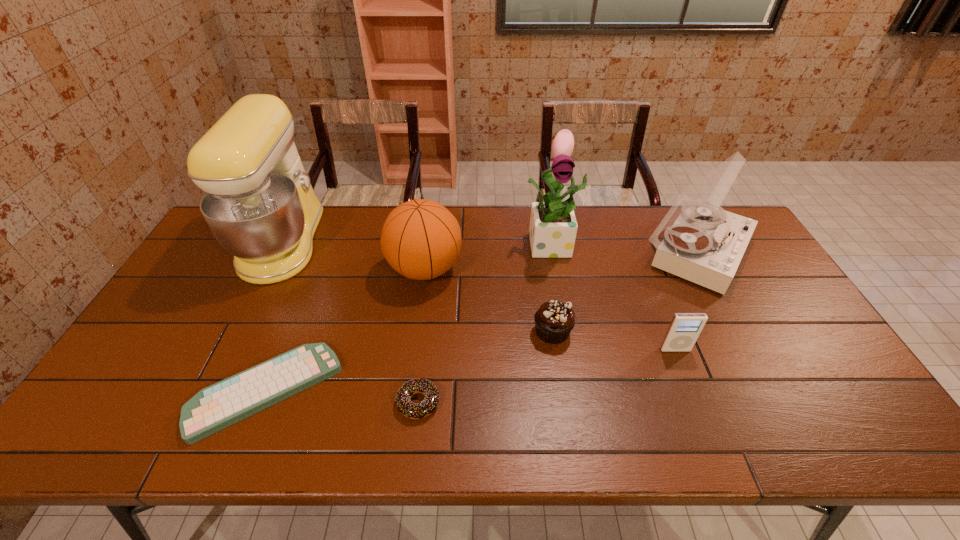
In order to click on free area in between the fifth tallest object and the cupcake in this screenshot , I will do `click(613, 341)`.

You are a GUI agent. You are given a task and a screenshot of the screen. Output one action in this format:
    pyautogui.click(x=<x>, y=<y>)
    Task: Click on the free space between the shortest object and the mixer
    This screenshot has height=540, width=960.
    Given the screenshot: What is the action you would take?
    pyautogui.click(x=276, y=317)

In order to click on free space between the cupcake and the shortest object in this screenshot , I will do `click(409, 362)`.

The image size is (960, 540). I want to click on free space between the basketball and the mixer, so click(x=354, y=255).

Image resolution: width=960 pixels, height=540 pixels. Identify the location of free space between the flower arrangement and the shortest object. (410, 318).

Identify the location of vacant area that lies between the iPod and the seventh shortest object. The image size is (960, 540). (614, 297).

The width and height of the screenshot is (960, 540). Identify the location of unoccupied position between the shortest object and the mixer. (276, 317).

I want to click on vacant space that's between the seventh tallest object and the shortest object, so tap(343, 397).

Identify the location of empty space between the basketball and the sixth shortest object. (561, 260).

Identify the location of free space between the fourth tallest object and the cupcake. (489, 301).